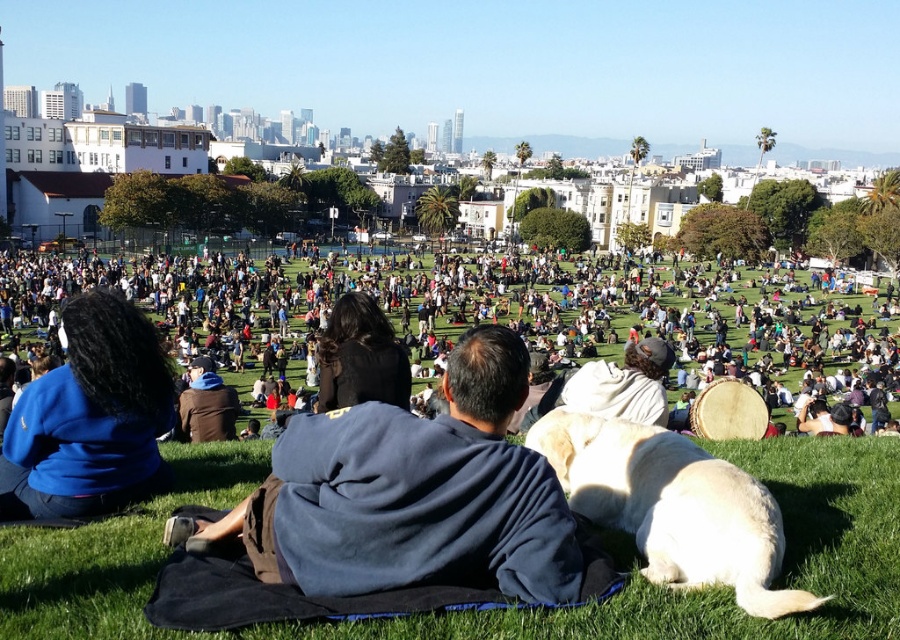
Who is lower down, white fluffy dog at center or dark blue jacket at lower left?

Positioned lower is dark blue jacket at lower left.

Between point (684, 374) and point (199, 372), which one is positioned behind?

Point (684, 374)

I want to click on white fluffy dog at center, so click(x=675, y=368).

Does white fluffy dog at center have a greater height compared to dark blue fleece at center?

Yes, white fluffy dog at center is taller than dark blue fleece at center.

The image size is (900, 640). Find the location of `white fluffy dog at center`. white fluffy dog at center is located at coordinates (675, 368).

Is point (816, 433) positioned after point (380, 576)?

Yes, it is.

This screenshot has height=640, width=900. I want to click on white fluffy dog at center, so click(x=675, y=368).

Between dark blue fleece at center and light yellow fur at lower center, which one is positioned lower?

dark blue fleece at center is lower down.

Where is `dark blue fleece at center`? dark blue fleece at center is located at coordinates (414, 493).